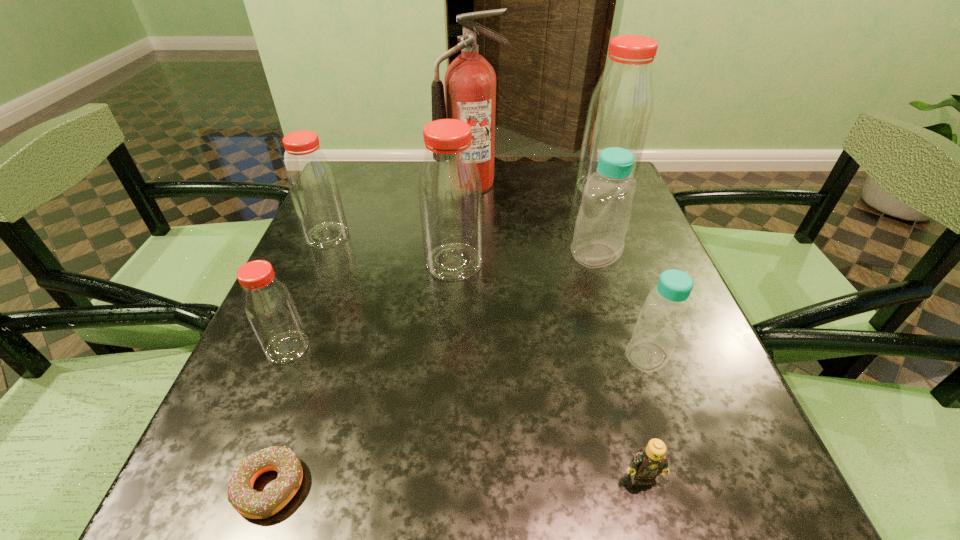
Image resolution: width=960 pixels, height=540 pixels. In order to click on Lego in this screenshot , I will do `click(650, 461)`.

Where is `chocolate doughnut`? chocolate doughnut is located at coordinates (250, 503).

Identify the location of the shortest object. The width and height of the screenshot is (960, 540). (250, 503).

I want to click on vacant space located on the front of the fire extinguisher near the operation label, so click(469, 244).

Locate an element on the screen. vacant area situated 0.150m on the left of the second tallest object is located at coordinates (519, 188).

Find the location of a particular element. This screenshot has width=960, height=540. vacant space located 0.090m on the front of the second biggest red bottle is located at coordinates (450, 314).

At what (x,y) coordinates should I click in order to perform the action: click on free region located 0.100m on the back of the bigger blue bottle. Please return your answer as a coordinate pair (x, y). The image size is (960, 540). Looking at the image, I should click on (584, 217).

Find the location of a particular element. Image resolution: width=960 pixels, height=540 pixels. free space located on the front of the second smallest red bottle is located at coordinates (252, 410).

You are a GUI agent. You are given a task and a screenshot of the screen. Output one action in this format:
    pyautogui.click(x=<x>, y=<y>)
    Task: Click on the vacant region located on the back of the nearest red bottle
    
    Given the screenshot: What is the action you would take?
    pyautogui.click(x=332, y=238)

Where is `vacant space positioned 0.060m on the left of the smaller blue bottle`? The height and width of the screenshot is (540, 960). vacant space positioned 0.060m on the left of the smaller blue bottle is located at coordinates (588, 356).